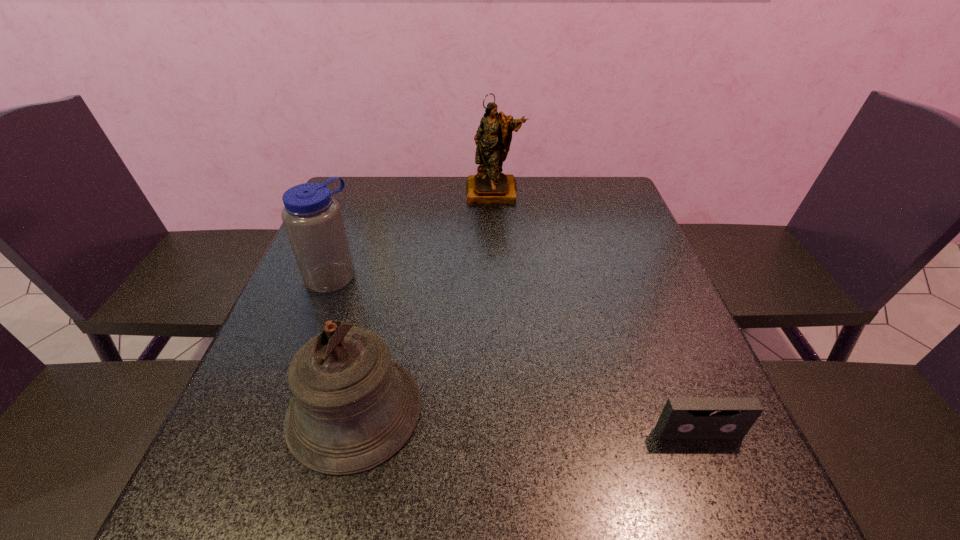
This screenshot has width=960, height=540. Find the location of `blank space located 0.050m with a carrying loop on the side of the second farthest object`. blank space located 0.050m with a carrying loop on the side of the second farthest object is located at coordinates (356, 300).

The image size is (960, 540). I want to click on free space located with a carrying loop on the side of the second farthest object, so click(406, 342).

Where is `vacant space situated 0.160m with a carrying loop on the side of the second farthest object`? vacant space situated 0.160m with a carrying loop on the side of the second farthest object is located at coordinates (386, 325).

Where is `object present at the far edge`? This screenshot has height=540, width=960. object present at the far edge is located at coordinates (493, 138).

Find the location of a particular element. The width and height of the screenshot is (960, 540). bell present at the near edge is located at coordinates (353, 408).

Locate an element on the screen. videotape positioned at the near edge is located at coordinates (682, 417).

Where is `bell positioned at the left edge`? This screenshot has width=960, height=540. bell positioned at the left edge is located at coordinates (353, 408).

At what (x,y) coordinates should I click in order to perform the action: click on water bottle situated at the left edge. Please return your answer as a coordinate pair (x, y). The image size is (960, 540). Looking at the image, I should click on (313, 221).

The image size is (960, 540). Find the location of `object situated at the right edge`. object situated at the right edge is located at coordinates (682, 417).

Where is `object present at the near left corner`? The image size is (960, 540). object present at the near left corner is located at coordinates (353, 408).